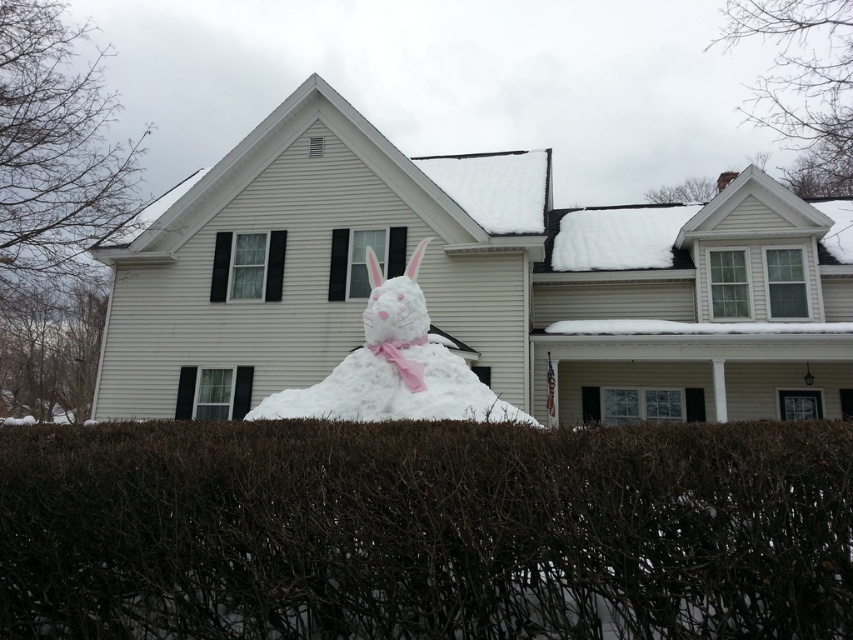
You are a gardener who wants to place a new decorative snowman on the front yard. The snowman must be placed in a position where it is taller than the brown textured hedge at lower center. Is the current white fluffy snowman at center positioned correctly?

The brown textured hedge at lower center is shorter than the white fluffy snowman at center, so the current white fluffy snowman at center is positioned correctly as it meets the requirement of being taller than the brown textured hedge at lower center.

Looking at this image, you are standing in front of the house and want to place a small gift box on the closest object to you. Which object should you choose between the brown textured hedge at lower center and the white fluffy snowman at center?

The brown textured hedge at lower center is below the white fluffy snowman at center, so the hedge is closer to you. Place the gift box on the brown textured hedge at lower center.

You are standing in the winter scene and want to locate the brown textured hedge at lower center. Which coordinate point should you look at?

You should look at point (425, 531) to locate the brown textured hedge at lower center.